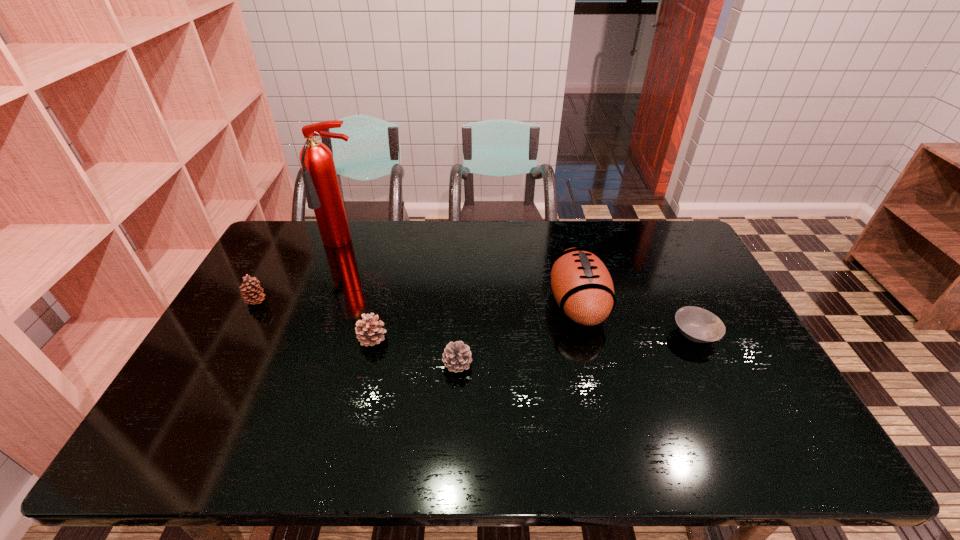
This screenshot has height=540, width=960. In order to click on free space that satisfies the following two spatial constraints: 1. on the front side of the bowl; 2. on the right side of the leftmost object in this screenshot , I will do `click(238, 334)`.

This screenshot has height=540, width=960. Identify the location of blank area in the image that satisfies the following two spatial constraints: 1. at the nozzle of the second object from left to right; 2. on the right side of the fifth object from left to right. (322, 304).

Locate an element on the screen. This screenshot has height=540, width=960. free location that satisfies the following two spatial constraints: 1. on the front side of the bowl; 2. on the right side of the second tallest object is located at coordinates (585, 334).

This screenshot has height=540, width=960. I want to click on free point that satisfies the following two spatial constraints: 1. at the nozzle of the tallest object; 2. on the right side of the second nearest pinecone, so click(308, 338).